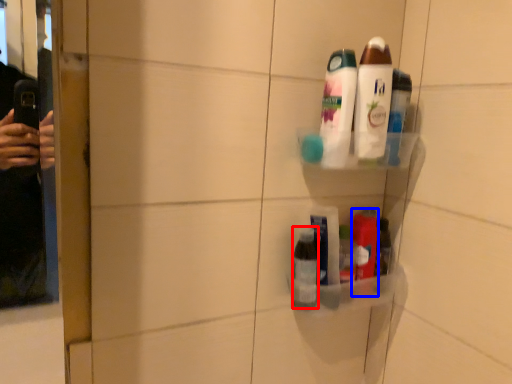
Question: Which object is further to the camera taking this photo, toiletry (highlighted by a red box) or toiletry (highlighted by a blue box)?

Choices:
 (A) toiletry
 (B) toiletry

Answer: (B)